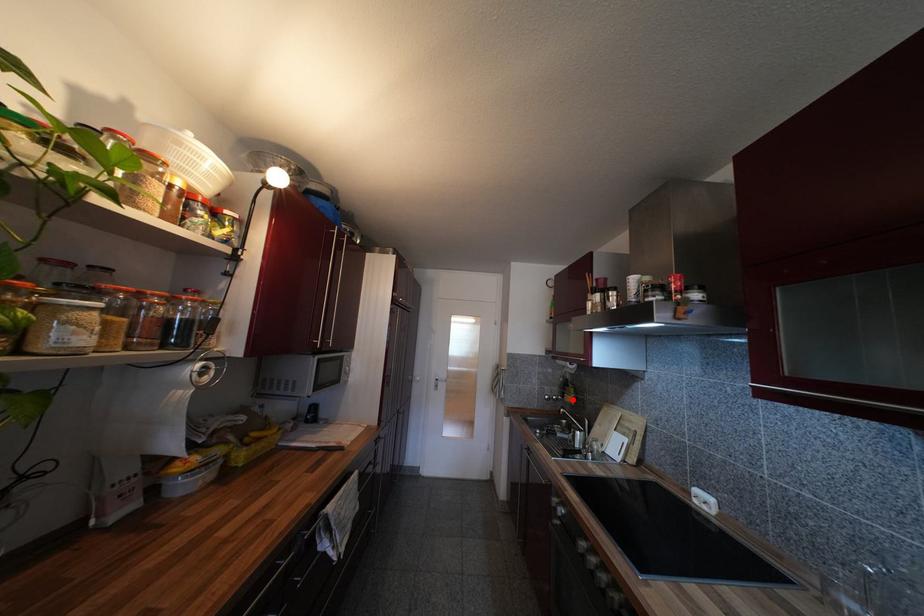
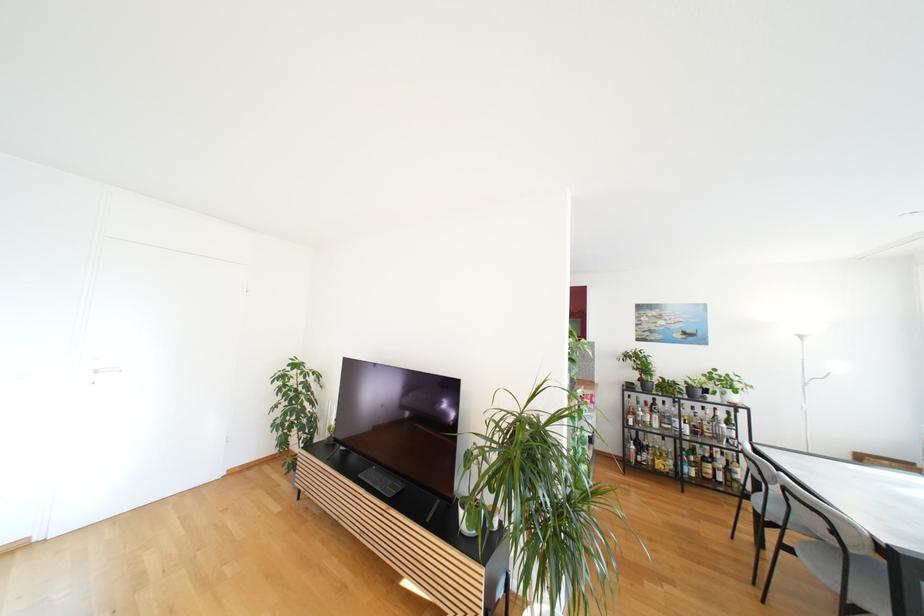
Question: I am providing you with two images of the same scene from different viewpoints. A red point is marked on the first image. Can you still see the location of the red point in image 2?

Choices:
 (A) Yes
 (B) No

Answer: (B)